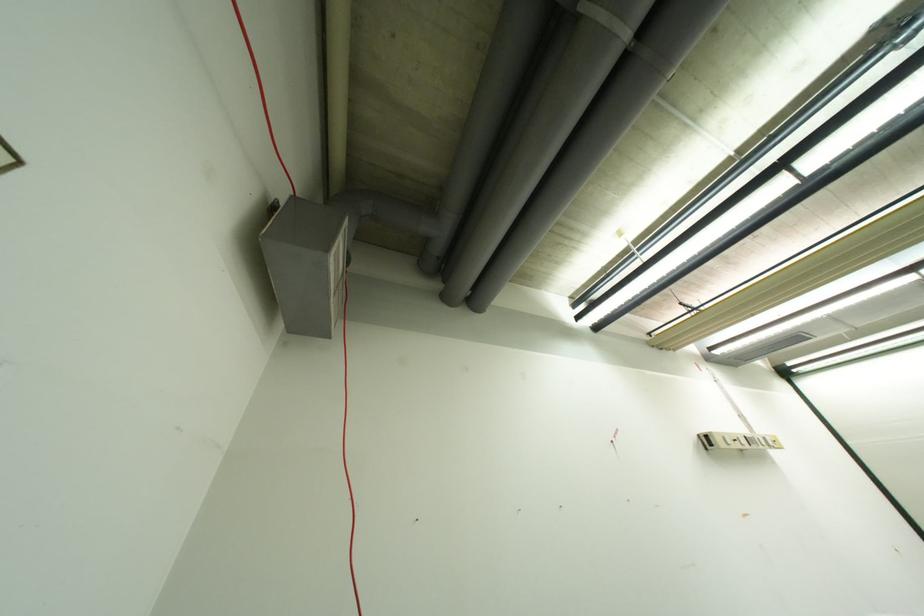
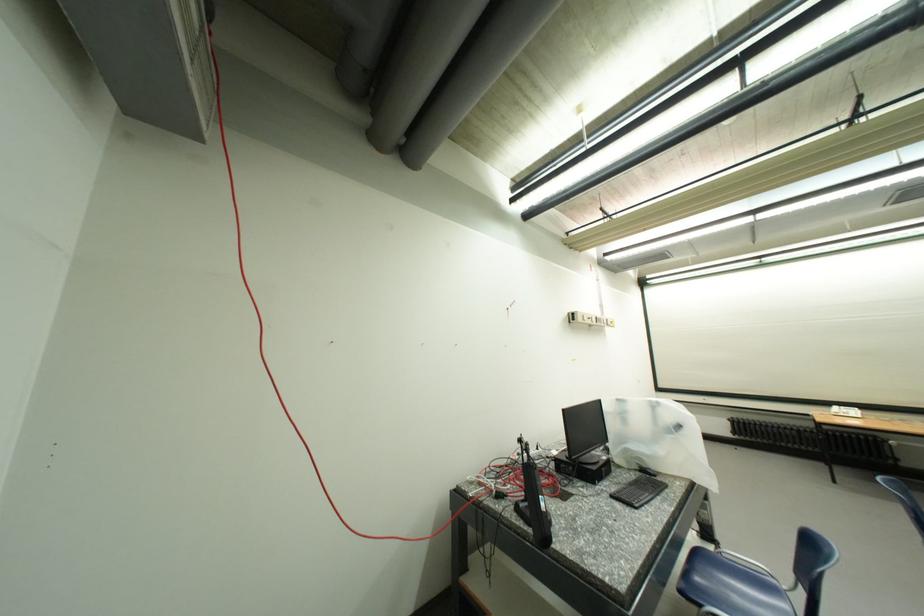
First-person continuous shooting, in which direction is the camera rotating?

The camera rotated toward right-down.